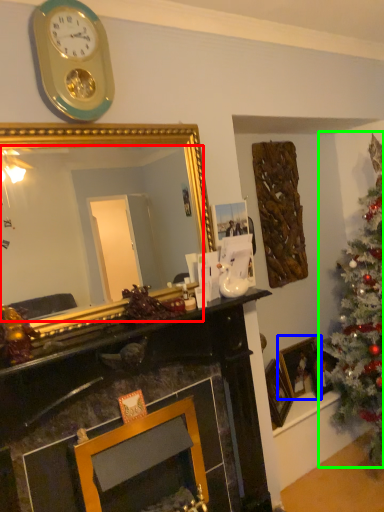
Question: Which object is positioned farthest from mirror (highlighted by a red box)? Select from picture frame (highlighted by a blue box) and christmas tree (highlighted by a green box).

Choices:
 (A) picture frame
 (B) christmas tree

Answer: (A)